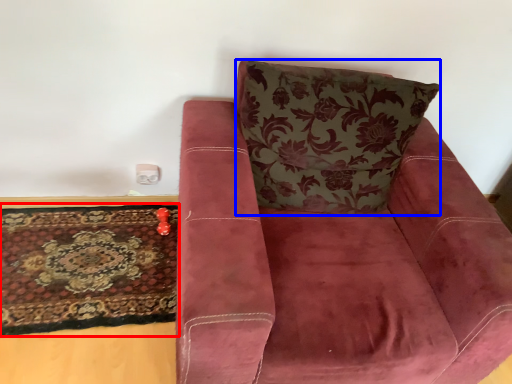
Question: Which object appears farthest to the camera in this image, mat (highlighted by a red box) or throw pillow (highlighted by a blue box)?

Choices:
 (A) mat
 (B) throw pillow

Answer: (A)